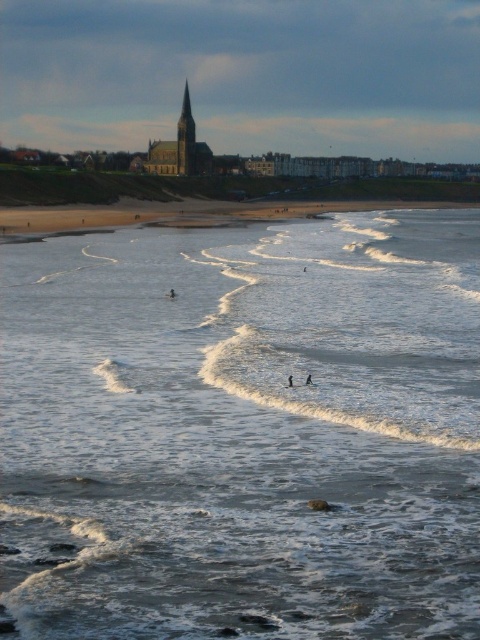
Question: Which point is farther to the camera?

Choices:
 (A) clear water at lower center
 (B) black matte surfboard at lower center
 (C) black foam surfboard at center

Answer: (B)

Question: Which point appears farthest from the camera in this image?

Choices:
 (A) click(168, 292)
 (B) click(311, 385)
 (C) click(291, 381)
 (D) click(291, 387)

Answer: (A)

Question: Does black matte surfboard at center have a lesser width compared to black foam surfboard at center?

Choices:
 (A) yes
 (B) no

Answer: (A)

Question: Where is white foam surfboard at center located in relation to black matte surfboard at lower center in the image?

Choices:
 (A) above
 (B) below

Answer: (B)

Question: Does dark blue fabric person at center appear under white foam surfboard at center?

Choices:
 (A) yes
 (B) no

Answer: (B)

Question: Estimate the real-world distances between objects in this image. Which object is farther from the black matte surfboard at center?

Choices:
 (A) clear water at lower center
 (B) black matte surfboard at lower center
 (C) black foam surfboard at center
 (D) white foam surfboard at center

Answer: (A)